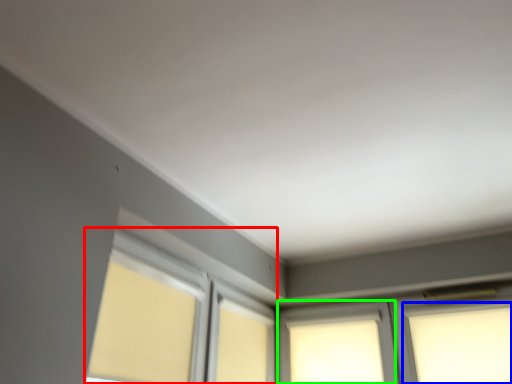
Question: Which is farther away from bay window (highlighted by a red box)? window (highlighted by a blue box) or window (highlighted by a green box)?

Choices:
 (A) window
 (B) window

Answer: (A)